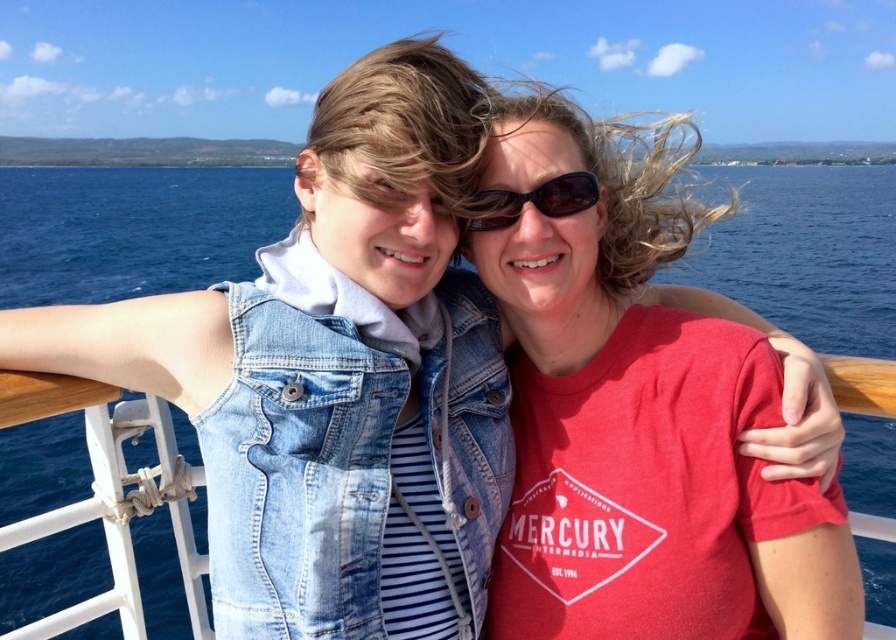
Is blue water at center positioned before faded denim jacket at lower right?

No.

Between blue water at center and faded denim jacket at lower right, which one is positioned higher?

blue water at center is higher up.

Image resolution: width=896 pixels, height=640 pixels. What are the coordinates of `blue water at center` in the screenshot? It's located at (132, 228).

Is point (523, 422) farther from camera compared to point (556, 186)?

Yes, it is.

Who is more forward, (527, 451) or (550, 202)?

Point (550, 202) is more forward.

Is point (569, 509) positioned after point (576, 198)?

No.

I want to click on matte red t-shirt at center, so point(638,422).

Does point (565, 580) lie in front of point (85, 224)?

Yes, point (565, 580) is in front of point (85, 224).

Which of these two, matte red t-shirt at center or blue water at center, stands taller?

blue water at center

Looking at this image, who is more distant from viewer, (691,596) or (776,260)?

Positioned behind is point (776,260).

At what (x,y) coordinates should I click in order to perform the action: click on matte red t-shirt at center. Please return your answer as a coordinate pair (x, y). Looking at the image, I should click on [x=638, y=422].